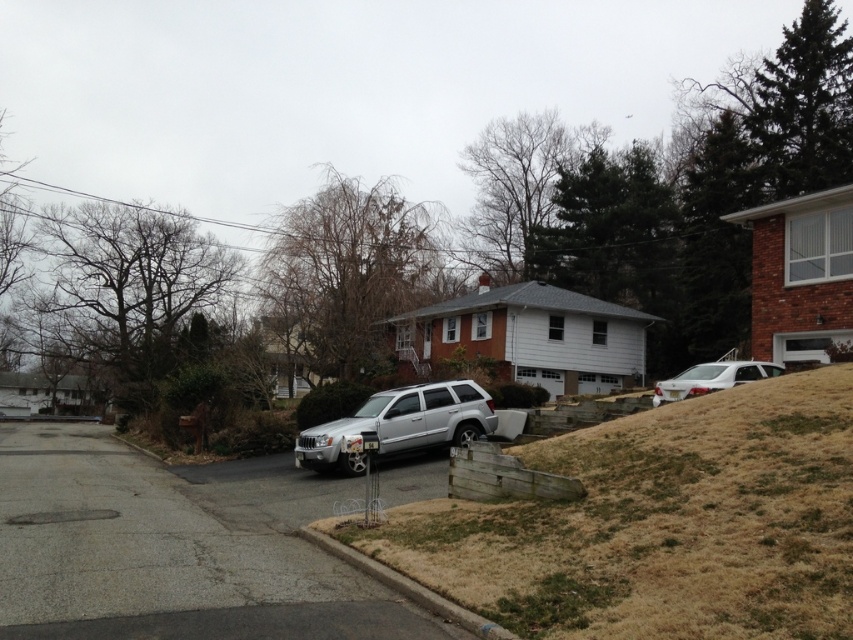
Can you confirm if brown grass at lower right is shorter than silver metallic suv at center?

Yes, brown grass at lower right is shorter than silver metallic suv at center.

Does brown grass at lower right have a larger size compared to silver metallic suv at center?

No, brown grass at lower right is not bigger than silver metallic suv at center.

Does point (611, 502) lie in front of point (450, 442)?

Yes, point (611, 502) is in front of point (450, 442).

The height and width of the screenshot is (640, 853). I want to click on brown grass at lower right, so click(x=660, y=524).

Does brown concrete curb at lower center appear on the right side of white glossy sedan at upper right?

Incorrect, brown concrete curb at lower center is not on the right side of white glossy sedan at upper right.

Is brown concrete curb at lower center further to camera compared to white glossy sedan at upper right?

No, it is in front of white glossy sedan at upper right.

Does point (480, 634) come farther from viewer compared to point (683, 380)?

No, (480, 634) is closer to viewer.

Identify the location of brown concrete curb at lower center. The height and width of the screenshot is (640, 853). (405, 586).

Which is more to the left, silver metallic suv at center or white glossy sedan at upper right?

silver metallic suv at center is more to the left.

Is silver metallic suv at center shorter than white glossy sedan at upper right?

Incorrect, silver metallic suv at center's height does not fall short of white glossy sedan at upper right's.

The height and width of the screenshot is (640, 853). What are the coordinates of `silver metallic suv at center` in the screenshot? It's located at (399, 424).

Locate an element on the screen. silver metallic suv at center is located at coordinates point(399,424).